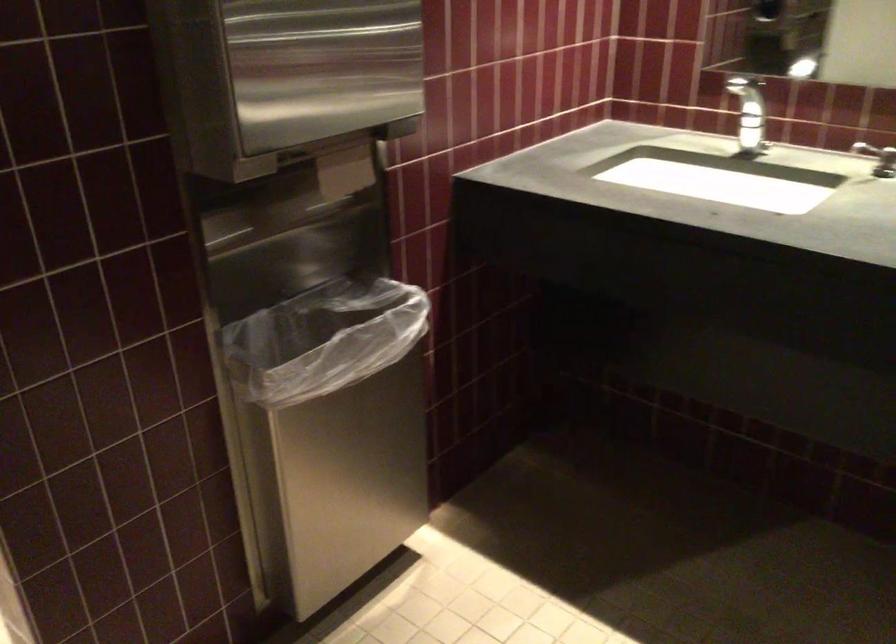
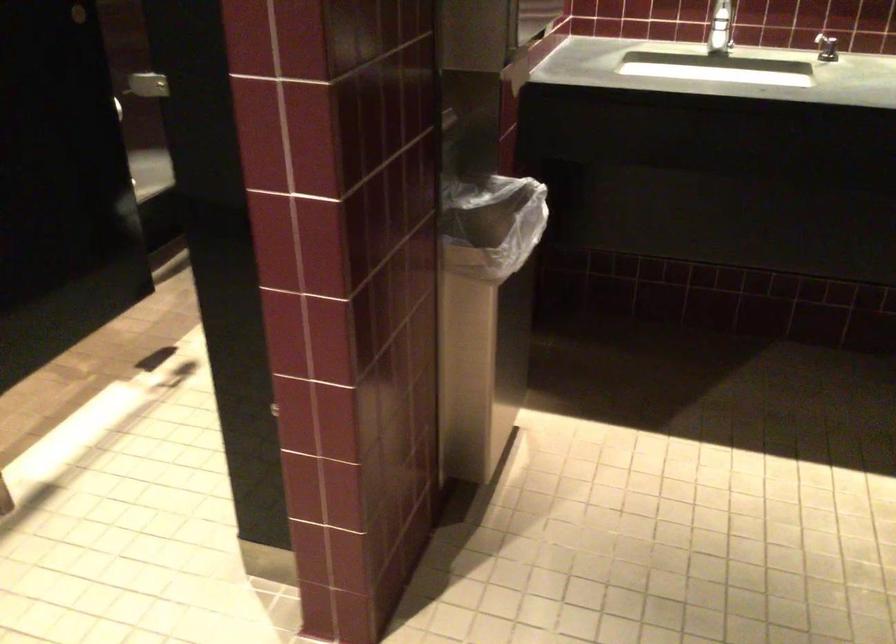
Question: In a continuous first-person perspective shot, in which direction is the camera moving?

Choices:
 (A) Left
 (B) Right
 (C) Forward
 (D) Backward

Answer: (A)